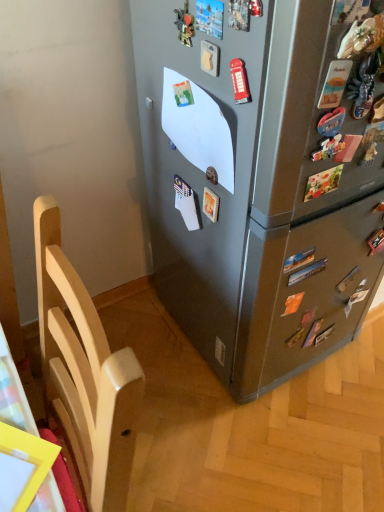
Question: From the image's perspective, is light wood chair at left located above satin gray refrigerator at center?

Choices:
 (A) no
 (B) yes

Answer: (A)

Question: Is light wood chair at left positioned before satin gray refrigerator at center?

Choices:
 (A) yes
 (B) no

Answer: (A)

Question: Is light wood chair at left turned away from satin gray refrigerator at center?

Choices:
 (A) yes
 (B) no

Answer: (B)

Question: Is light wood chair at left bigger than satin gray refrigerator at center?

Choices:
 (A) yes
 (B) no

Answer: (B)

Question: Does light wood chair at left have a lesser width compared to satin gray refrigerator at center?

Choices:
 (A) yes
 (B) no

Answer: (A)

Question: Can satin gray refrigerator at center be found inside light wood chair at left?

Choices:
 (A) no
 (B) yes

Answer: (A)

Question: Is the position of satin gray refrigerator at center more distant than that of light wood chair at left?

Choices:
 (A) yes
 (B) no

Answer: (A)

Question: Can you confirm if satin gray refrigerator at center is taller than light wood chair at left?

Choices:
 (A) no
 (B) yes

Answer: (B)

Question: Considering the relative sizes of satin gray refrigerator at center and light wood chair at left in the image provided, is satin gray refrigerator at center wider than light wood chair at left?

Choices:
 (A) yes
 (B) no

Answer: (A)

Question: From the image's perspective, is satin gray refrigerator at center on light wood chair at left?

Choices:
 (A) no
 (B) yes

Answer: (B)

Question: Considering the relative sizes of satin gray refrigerator at center and light wood chair at left in the image provided, is satin gray refrigerator at center bigger than light wood chair at left?

Choices:
 (A) yes
 (B) no

Answer: (A)

Question: Is satin gray refrigerator at center with light wood chair at left?

Choices:
 (A) no
 (B) yes

Answer: (A)

Question: Considering the positions of satin gray refrigerator at center and light wood chair at left in the image, is satin gray refrigerator at center taller or shorter than light wood chair at left?

Choices:
 (A) short
 (B) tall

Answer: (B)